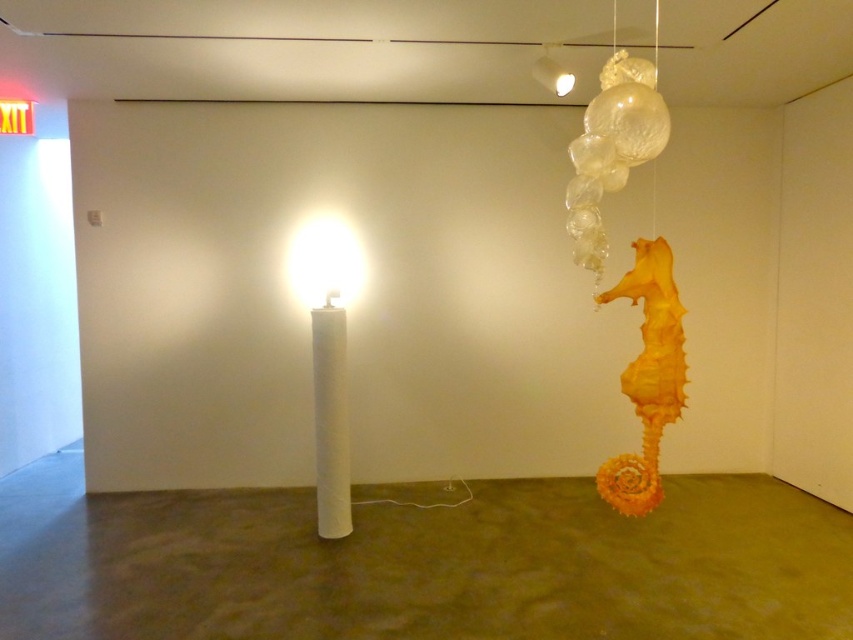
Does translucent glass seahorse at upper right appear over matte white lamp at center?

Yes, translucent glass seahorse at upper right is above matte white lamp at center.

Between point (664, 106) and point (335, 252), which one is positioned behind?

The point (335, 252) is behind.

Identify the location of translucent glass seahorse at upper right. The image size is (853, 640). (612, 145).

Can you confirm if white matte cylinder at center is bigger than matte white lamp at center?

Yes, white matte cylinder at center is bigger than matte white lamp at center.

Who is taller, white matte cylinder at center or matte white lamp at center?

white matte cylinder at center is taller.

This screenshot has width=853, height=640. I want to click on white matte cylinder at center, so click(329, 420).

At what (x,y) coordinates should I click in order to perform the action: click on white matte cylinder at center. Please return your answer as a coordinate pair (x, y). The image size is (853, 640). Looking at the image, I should click on (329, 420).

Can you confirm if white glossy cylinder at center is taller than matte white lamp at center?

Correct, white glossy cylinder at center is much taller as matte white lamp at center.

Between point (340, 506) and point (318, 227), which one is positioned in front?

Point (340, 506)

Find the location of `white glossy cylinder at center`. white glossy cylinder at center is located at coordinates (328, 358).